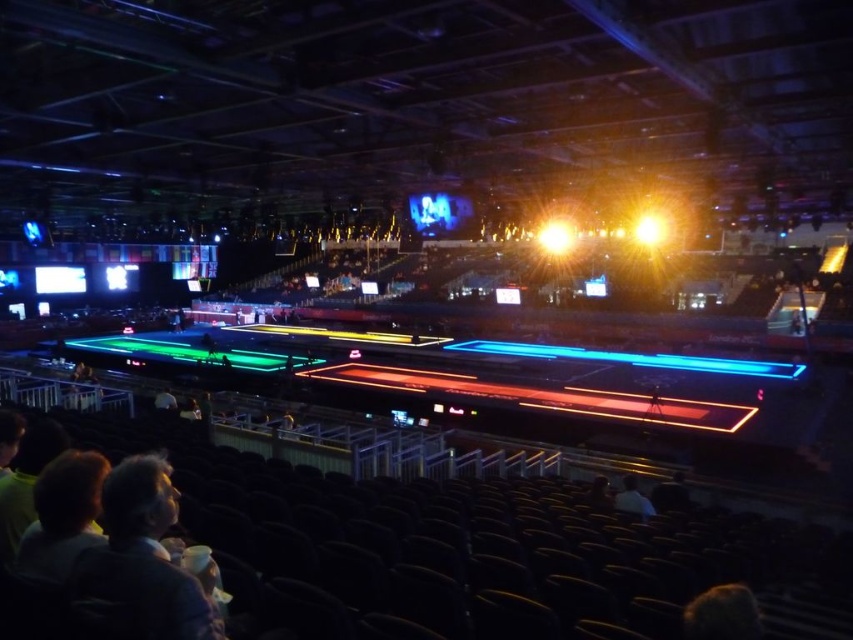
Question: Is bright yellow spotlight at center in front of white fabric person at lower left?

Choices:
 (A) yes
 (B) no

Answer: (B)

Question: Does dark brown hair at lower right appear over white fabric shirt at lower right?

Choices:
 (A) yes
 (B) no

Answer: (A)

Question: Which of the following is the closest to the observer?

Choices:
 (A) bright yellow spotlight at center
 (B) white fabric shirt at lower right
 (C) white fabric person at lower left
 (D) dark brown hair at lower right

Answer: (D)

Question: Which object appears closest to the camera in this image?

Choices:
 (A) white fabric shirt at lower right
 (B) bright yellow light at center

Answer: (A)

Question: Can you confirm if white fabric shirt at lower right is positioned above dark gray fabric jacket at lower right?

Choices:
 (A) yes
 (B) no

Answer: (A)

Question: Among these points, which one is farthest from the camera?

Choices:
 (A) (635, 500)
 (B) (167, 387)
 (C) (202, 609)
 (D) (589, 500)

Answer: (B)